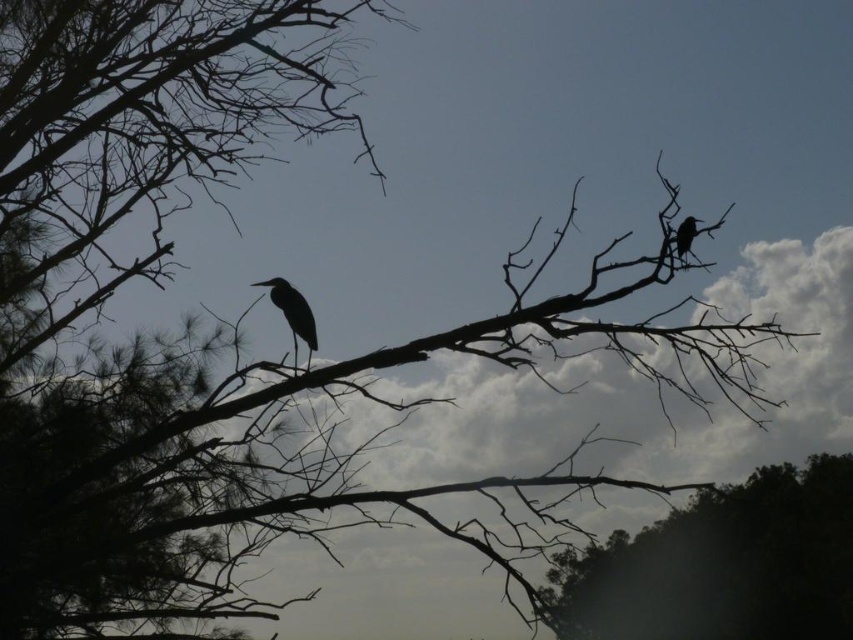
Which of these two, dark brown bark tree at lower right or matte black bird at upper right, stands shorter?

Standing shorter between the two is matte black bird at upper right.

Does dark brown bark tree at lower right appear on the right side of matte black bird at upper right?

Yes, dark brown bark tree at lower right is to the right of matte black bird at upper right.

The width and height of the screenshot is (853, 640). I want to click on dark brown bark tree at lower right, so click(x=721, y=564).

Is dark brown bark tree at lower right shorter than matte black bird at center?

In fact, dark brown bark tree at lower right may be taller than matte black bird at center.

Which is above, dark brown bark tree at lower right or matte black bird at center?

matte black bird at center

Consider the image. Who is more forward, (729, 573) or (299, 307)?

Point (299, 307)

Locate an element on the screen. The width and height of the screenshot is (853, 640). dark brown bark tree at lower right is located at coordinates (721, 564).

Who is lower down, matte black bird at center or matte black bird at upper right?

Positioned lower is matte black bird at center.

Does point (277, 280) come in front of point (692, 218)?

Yes, it is.

Where is `matte black bird at center`? matte black bird at center is located at coordinates (292, 312).